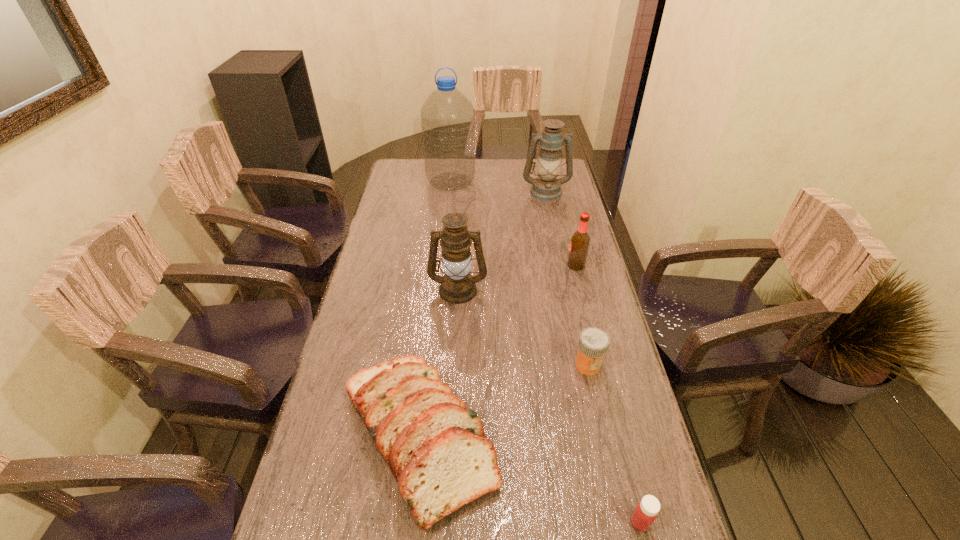
Locate which object is the closest to the farther medicine. Please provide its 2D coordinates. Your answer should be formatted as a tuple, i.e. [(x, y)], where the tuple contains the x and y coordinates of a point satisfying the conditions above.

[(436, 449)]

Identify which object is located as the fourth nearest to the farther oil lamp. Please provide its 2D coordinates. Your answer should be formatted as a tuple, i.e. [(x, y)], where the tuple contains the x and y coordinates of a point satisfying the conditions above.

[(593, 343)]

Locate an element on the screen. Image resolution: width=960 pixels, height=540 pixels. vacant area in the image that satisfies the following two spatial constraints: 1. on the front side of the tallest object; 2. on the left side of the right oil lamp is located at coordinates (450, 191).

The image size is (960, 540). In order to click on vacant space that satisfies the following two spatial constraints: 1. on the front side of the shorter medicine; 2. on the right side of the right oil lamp in this screenshot , I will do `click(615, 522)`.

You are a GUI agent. You are given a task and a screenshot of the screen. Output one action in this format:
    pyautogui.click(x=<x>, y=<y>)
    Task: Click on the free spot that satisfies the following two spatial constraints: 1. on the label side of the taller medicine; 2. on the left side of the nearer medicine
    The height and width of the screenshot is (540, 960).
    Given the screenshot: What is the action you would take?
    pyautogui.click(x=622, y=522)

Find the location of `free space that satisfies the following two spatial constraints: 1. on the front side of the nearer medicine; 2. on the left side of the right oil lamp`. free space that satisfies the following two spatial constraints: 1. on the front side of the nearer medicine; 2. on the left side of the right oil lamp is located at coordinates (615, 522).

The image size is (960, 540). I want to click on free spot that satisfies the following two spatial constraints: 1. on the label side of the farther medicine; 2. on the right side of the shorter medicine, so click(622, 522).